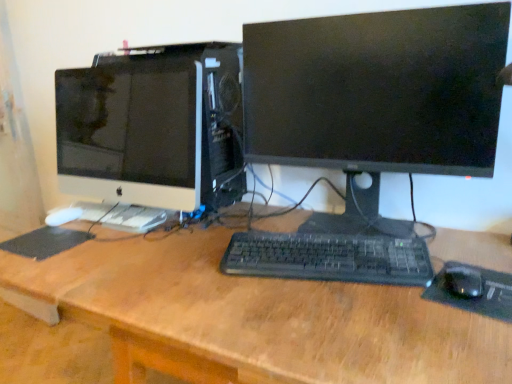
This screenshot has width=512, height=384. Describe the element at coordinates (122, 216) in the screenshot. I see `white matte keyboard at left` at that location.

Find the location of a particular element. This screenshot has height=384, width=512. white glossy computer monitor at left, positioned as the 1th computer monitor in left-to-right order is located at coordinates (154, 126).

Describe the element at coordinates (251, 318) in the screenshot. I see `wooden desk at center` at that location.

What do you see at coordinates (45, 242) in the screenshot? Image resolution: width=512 pixels, height=384 pixels. I see `black matte mousepad at lower left, which appears as the second mousepad when viewed from the front` at bounding box center [45, 242].

Find the location of `white matte keyboard at left`. white matte keyboard at left is located at coordinates (122, 216).

Consider the image. From the image's perspective, which one is positioned higher, white glossy computer monitor at left, the 2th computer monitor positioned from the right, or black matte mousepad at lower left, the 1th mousepad from the back?

From the image's view, white glossy computer monitor at left, the 2th computer monitor positioned from the right, is above.

In the image, is white glossy computer monitor at left, the 2th computer monitor positioned from the right, on the left side or the right side of black matte mousepad at lower left, marked as the first mousepad in a left-to-right arrangement?

From the image, it's evident that white glossy computer monitor at left, the 2th computer monitor positioned from the right, is to the right of black matte mousepad at lower left, marked as the first mousepad in a left-to-right arrangement.

Which is more distant, (72,89) or (62,235)?

Point (72,89)

Looking at their sizes, would you say black plastic keyboard at center is wider or thinner than white matte keyboard at left?

Clearly, black plastic keyboard at center has more width compared to white matte keyboard at left.

From the image's perspective, which one is positioned lower, black plastic keyboard at center or white matte keyboard at left?

black plastic keyboard at center is shown below in the image.

Is white matte keyboard at left surrounded by black plastic keyboard at center?

No, white matte keyboard at left is not surrounded by black plastic keyboard at center.

Based on their sizes in the image, would you say black plastic keyboard at center is bigger or smaller than white matte keyboard at left?

Clearly, black plastic keyboard at center is larger in size than white matte keyboard at left.

In the scene shown: Is white matte keyboard at left shorter than black matte monitor at center, the second computer monitor from the left?

Indeed, white matte keyboard at left has a lesser height compared to black matte monitor at center, the second computer monitor from the left.

Between point (114, 214) and point (283, 41), which one is positioned behind?

The point (114, 214) is farther from the camera.

From the image's perspective, which one is positioned lower, white matte keyboard at left or black matte monitor at center, the second computer monitor from the left?

white matte keyboard at left, from the image's perspective.

Do you think white matte keyboard at left is within black matte monitor at center, the second computer monitor from the left, or outside of it?

white matte keyboard at left is not inside black matte monitor at center, the second computer monitor from the left, it's outside.

Is black matte monitor at center, the second computer monitor from the left, aimed at black rubber mousepad at lower right, the 2th mousepad in the left-to-right sequence?

Yes, black matte monitor at center, the second computer monitor from the left, is facing black rubber mousepad at lower right, the 2th mousepad in the left-to-right sequence.

Which of these two, black matte monitor at center, which is counted as the first computer monitor, starting from the right, or black rubber mousepad at lower right, which ranks as the 2th mousepad in back-to-front order, is bigger?

With larger size is black matte monitor at center, which is counted as the first computer monitor, starting from the right.

Which point is more distant from viewer, (312,62) or (505,294)?

The point (312,62) is behind.

From the picture: From a real-world perspective, is black matte monitor at center, the second computer monitor from the left, beneath black rubber mousepad at lower right, the 2th mousepad in the left-to-right sequence?

No, from a real-world perspective, black matte monitor at center, the second computer monitor from the left, is not under black rubber mousepad at lower right, the 2th mousepad in the left-to-right sequence.

Is black rubber mousepad at lower right, the 2th mousepad in the left-to-right sequence, at the left side of black matte mousepad at lower left, marked as the first mousepad in a left-to-right arrangement?

In fact, black rubber mousepad at lower right, the 2th mousepad in the left-to-right sequence, is to the right of black matte mousepad at lower left, marked as the first mousepad in a left-to-right arrangement.

Does black rubber mousepad at lower right, which ranks as the 2th mousepad in back-to-front order, have a greater width compared to black matte mousepad at lower left, which is the 2th mousepad in right-to-left order?

Yes.

Would you say black matte mousepad at lower left, which appears as the second mousepad when viewed from the front, is part of black rubber mousepad at lower right, the 2th mousepad in the left-to-right sequence,'s contents?

No, black matte mousepad at lower left, which appears as the second mousepad when viewed from the front, is not inside black rubber mousepad at lower right, the 2th mousepad in the left-to-right sequence.

Consider the image. From a real-world perspective, is black matte monitor at center, the second computer monitor from the left, positioned above or below black matte mousepad at lower left, the 1th mousepad from the back?

Clearly, from a real-world perspective, black matte monitor at center, the second computer monitor from the left, is above black matte mousepad at lower left, the 1th mousepad from the back.

Can you confirm if black matte monitor at center, which is counted as the first computer monitor, starting from the right, is wider than black matte mousepad at lower left, which appears as the second mousepad when viewed from the front?

Yes.

From the image's perspective, is black matte monitor at center, the second computer monitor from the left, located beneath black matte mousepad at lower left, which is the 2th mousepad in right-to-left order?

Actually, black matte monitor at center, the second computer monitor from the left, appears above black matte mousepad at lower left, which is the 2th mousepad in right-to-left order, in the image.

Is black matte monitor at center, which is counted as the first computer monitor, starting from the right, behind black matte mousepad at lower left, which appears as the second mousepad when viewed from the front?

No, black matte monitor at center, which is counted as the first computer monitor, starting from the right, is closer to the viewer.

Between black plastic keyboard at center and black matte mousepad at lower left, which appears as the second mousepad when viewed from the front, which one has larger size?

black plastic keyboard at center.

From the image's perspective, who appears lower, black plastic keyboard at center or black matte mousepad at lower left, marked as the first mousepad in a left-to-right arrangement?

black plastic keyboard at center.

Would you say black plastic keyboard at center is to the left or to the right of black matte mousepad at lower left, which is the 2th mousepad in right-to-left order, in the picture?

From the image, it's evident that black plastic keyboard at center is to the right of black matte mousepad at lower left, which is the 2th mousepad in right-to-left order.

I want to click on computer keyboard in front of the black matte mousepad at lower left, which appears as the second mousepad when viewed from the front, so click(x=329, y=258).

Identify the location of mousepad on the left of white glossy computer monitor at left, the 2th computer monitor positioned from the right. This screenshot has height=384, width=512. (45, 242).

The width and height of the screenshot is (512, 384). I want to click on computer keyboard below the white matte keyboard at left (from the image's perspective), so click(x=329, y=258).

Estimate the real-world distances between objects in this image. Which object is closer to wooden desk at center, black matte monitor at center, the second computer monitor from the left, or black plastic keyboard at center?

black plastic keyboard at center is positioned closer to the anchor wooden desk at center.

From the image, which object appears to be farther from wooden desk at center, white glossy computer monitor at left, the 2th computer monitor positioned from the right, or white matte keyboard at left?

The object further to wooden desk at center is white glossy computer monitor at left, the 2th computer monitor positioned from the right.

Considering their positions, is black plastic keyboard at center positioned further to black matte monitor at center, the second computer monitor from the left, than wooden desk at center?

wooden desk at center lies further to black matte monitor at center, the second computer monitor from the left, than the other object.

From the image, which object appears to be farther from white matte keyboard at left, black matte monitor at center, which is counted as the first computer monitor, starting from the right, or white glossy computer monitor at left, the 2th computer monitor positioned from the right?

The object further to white matte keyboard at left is black matte monitor at center, which is counted as the first computer monitor, starting from the right.

Considering their positions, is wooden desk at center positioned further to white matte keyboard at left than black rubber mousepad at lower right, the 2th mousepad in the left-to-right sequence?

black rubber mousepad at lower right, the 2th mousepad in the left-to-right sequence.

Which object lies further to the anchor point black rubber mousepad at lower right, which ranks as the 2th mousepad in back-to-front order, white glossy computer monitor at left, the 2th computer monitor positioned from the right, or wooden desk at center?

The object further to black rubber mousepad at lower right, which ranks as the 2th mousepad in back-to-front order, is white glossy computer monitor at left, the 2th computer monitor positioned from the right.

From the image, which object appears to be farther from black rubber mousepad at lower right, the 2th mousepad in the left-to-right sequence, white matte keyboard at left or black matte mousepad at lower left, which is the 2th mousepad in right-to-left order?

black matte mousepad at lower left, which is the 2th mousepad in right-to-left order, is positioned further to the anchor black rubber mousepad at lower right, the 2th mousepad in the left-to-right sequence.

Which object lies nearer to the anchor point white matte keyboard at left, wooden desk at center or white glossy computer monitor at left, the 2th computer monitor positioned from the right?

white glossy computer monitor at left, the 2th computer monitor positioned from the right.

Find the location of `computer keyboard between wooden desk at center and white matte keyboard at left in the front-back direction`. computer keyboard between wooden desk at center and white matte keyboard at left in the front-back direction is located at coordinates (329, 258).

Locate an element on the screen. computer monitor between white matte keyboard at left and black matte monitor at center, which is counted as the first computer monitor, starting from the right, in the horizontal direction is located at coordinates (154, 126).

At what (x,y) coordinates should I click in order to perform the action: click on computer monitor situated between black matte mousepad at lower left, the 1th mousepad from the back, and black plastic keyboard at center from left to right. Please return your answer as a coordinate pair (x, y). Image resolution: width=512 pixels, height=384 pixels. Looking at the image, I should click on (154, 126).

I want to click on computer keyboard between white matte keyboard at left and black rubber mousepad at lower right, the 1th mousepad positioned from the front, from left to right, so click(329, 258).